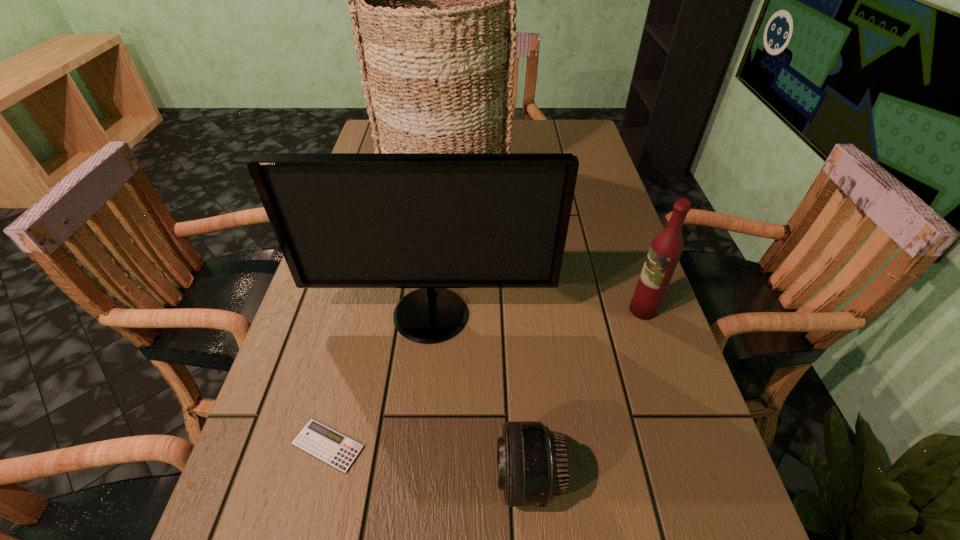
What are the coordinates of `basket` in the screenshot? It's located at (433, 0).

Find the location of a particular element. the farthest object is located at coordinates (433, 0).

The height and width of the screenshot is (540, 960). In order to click on the second tallest object in this screenshot , I will do `click(432, 221)`.

Find the location of `the third shortest object`. the third shortest object is located at coordinates (666, 248).

Locate an element on the screen. This screenshot has width=960, height=540. liquor is located at coordinates (666, 248).

I want to click on telephoto lens, so click(x=533, y=464).

The width and height of the screenshot is (960, 540). I want to click on the shortest object, so click(x=328, y=445).

The width and height of the screenshot is (960, 540). In order to click on free region located on the front of the basket in this screenshot , I will do `click(439, 233)`.

I want to click on free space located on the front-facing side of the computer monitor, so click(x=424, y=379).

Find the location of a particular element. The width and height of the screenshot is (960, 540). vacant space located 0.270m on the label of the rightmost object is located at coordinates (507, 310).